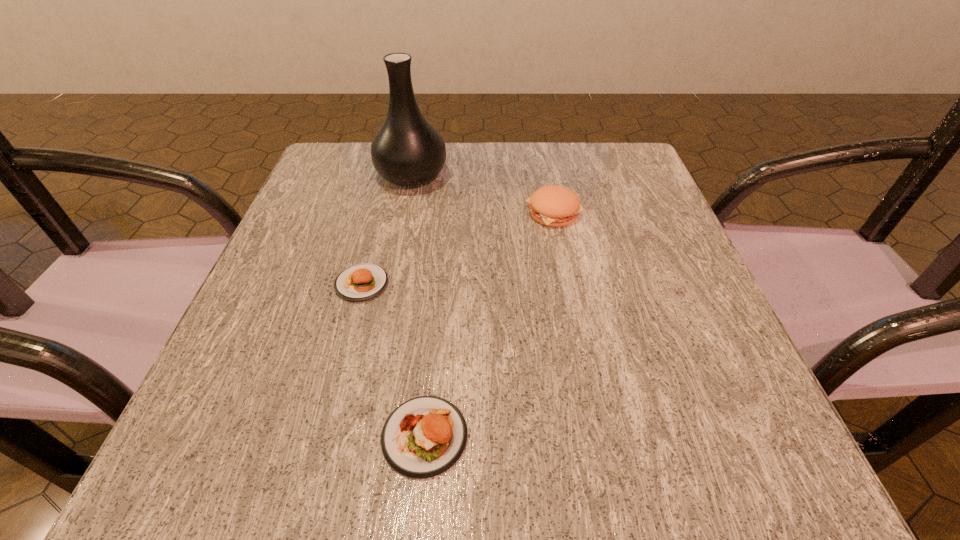
Where is `the tallest object`? the tallest object is located at coordinates (407, 150).

You are a GUI agent. You are given a task and a screenshot of the screen. Output one action in this format:
    pyautogui.click(x=<x>, y=<y>)
    Task: Click on the vase
    This screenshot has height=540, width=960.
    Given the screenshot: What is the action you would take?
    pyautogui.click(x=407, y=150)

Locate an element on the screen. the second farthest object is located at coordinates (555, 206).

Where is `the rightmost food`? The height and width of the screenshot is (540, 960). the rightmost food is located at coordinates click(x=555, y=206).

Locate an element on the screen. the second food from left to right is located at coordinates (425, 436).

This screenshot has height=540, width=960. What are the coordinates of `the nearest object` in the screenshot? It's located at (425, 436).

Identify the location of the second nearest object. The height and width of the screenshot is (540, 960). (360, 282).

The width and height of the screenshot is (960, 540). What are the coordinates of `the leftmost food` in the screenshot? It's located at (360, 282).

I want to click on free space located on the front of the tallest object, so click(403, 215).

Image resolution: width=960 pixels, height=540 pixels. Find the location of `free space located 0.180m on the left of the rightmost object`. free space located 0.180m on the left of the rightmost object is located at coordinates (437, 212).